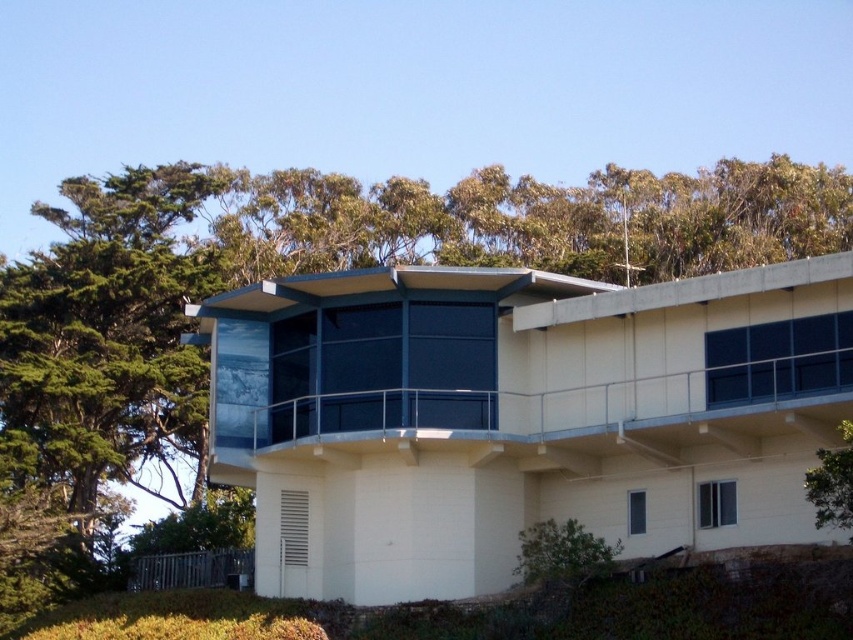
Question: Can you confirm if green leafy tree at upper left is smaller than white smooth balcony at center?

Choices:
 (A) no
 (B) yes

Answer: (A)

Question: Does green leafy tree at upper left appear under white smooth balcony at center?

Choices:
 (A) yes
 (B) no

Answer: (B)

Question: Does green leafy tree at upper left appear over white smooth balcony at center?

Choices:
 (A) yes
 (B) no

Answer: (A)

Question: Among these points, which one is farthest from the camera?

Choices:
 (A) (309, 198)
 (B) (370, 289)

Answer: (A)

Question: Which point appears farthest from the camera in this image?

Choices:
 (A) (215, 301)
 (B) (160, 259)

Answer: (B)